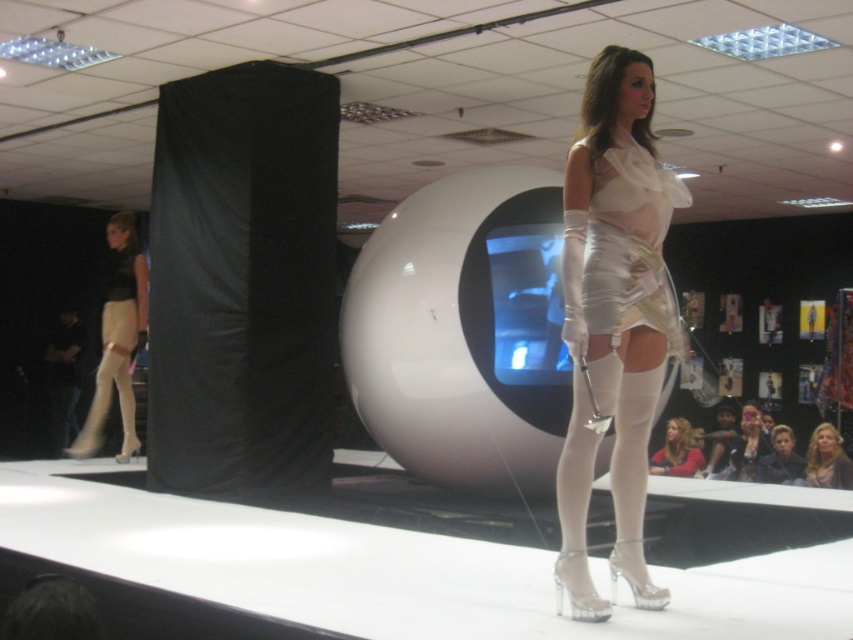
Can you confirm if matte white stockings at left is taller than blonde hair at center?

Indeed, matte white stockings at left has a greater height compared to blonde hair at center.

Which is in front, point (140, 266) or point (804, 477)?

Point (140, 266) is in front.

Is point (120, 416) in front of point (837, 444)?

No, (120, 416) is behind (837, 444).

Locate an element on the screen. This screenshot has height=640, width=853. matte white stockings at left is located at coordinates (117, 339).

Between satin white dress at center and matte white stockings at left, which one appears on the right side from the viewer's perspective?

satin white dress at center is more to the right.

Does satin white dress at center have a smaller size compared to matte white stockings at left?

Yes.

What do you see at coordinates (622, 248) in the screenshot?
I see `satin white dress at center` at bounding box center [622, 248].

Locate an element on the screen. satin white dress at center is located at coordinates (622, 248).

Does blonde hair at center have a lesser height compared to matte black dress at center?

In fact, blonde hair at center may be taller than matte black dress at center.

Is blonde hair at center taller than matte black dress at center?

Yes.

Locate an element on the screen. Image resolution: width=853 pixels, height=640 pixels. blonde hair at center is located at coordinates (827, 460).